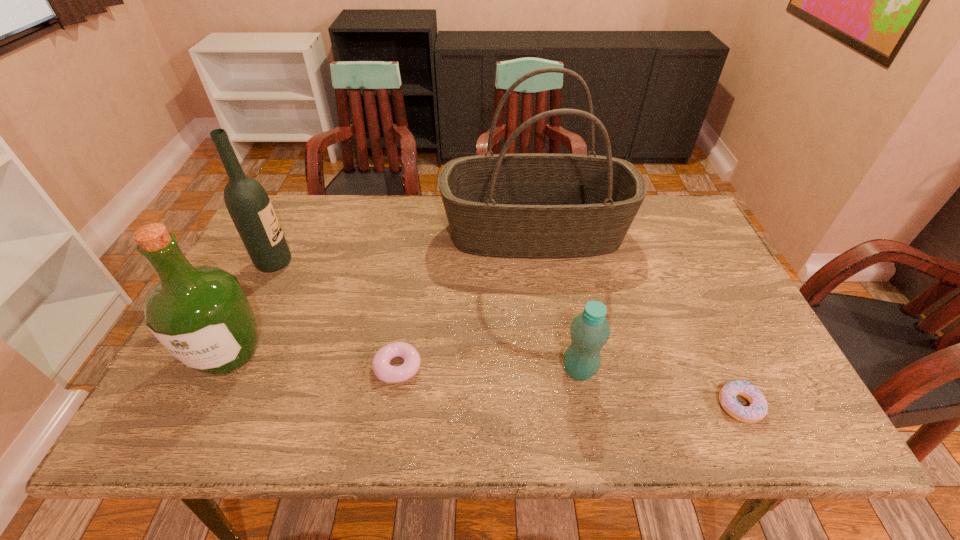
Identify the location of basket. The image size is (960, 540). (529, 205).

Locate an element on the screen. wine bottle is located at coordinates (247, 202).

Locate an element on the screen. This screenshot has height=540, width=960. liquor is located at coordinates (201, 315).

At what (x,y) coordinates should I click in order to perform the action: click on water bottle. Please return your answer as a coordinate pair (x, y). Image resolution: width=960 pixels, height=540 pixels. Looking at the image, I should click on (590, 331).

Locate an element on the screen. This screenshot has height=540, width=960. the left doughnut is located at coordinates (382, 369).

I want to click on the right doughnut, so click(x=758, y=408).

Locate an element on the screen. The height and width of the screenshot is (540, 960). blank space located 0.150m on the right of the basket is located at coordinates (678, 232).

In order to click on free spot located 0.230m on the labeled side of the wine bottle in this screenshot , I will do `click(372, 263)`.

The image size is (960, 540). What are the coordinates of `blank space located 0.050m on the front-facing side of the liquor` in the screenshot? It's located at (202, 408).

Identify the location of vacant area situated at the front cap of the water bottle. The width and height of the screenshot is (960, 540). (505, 370).